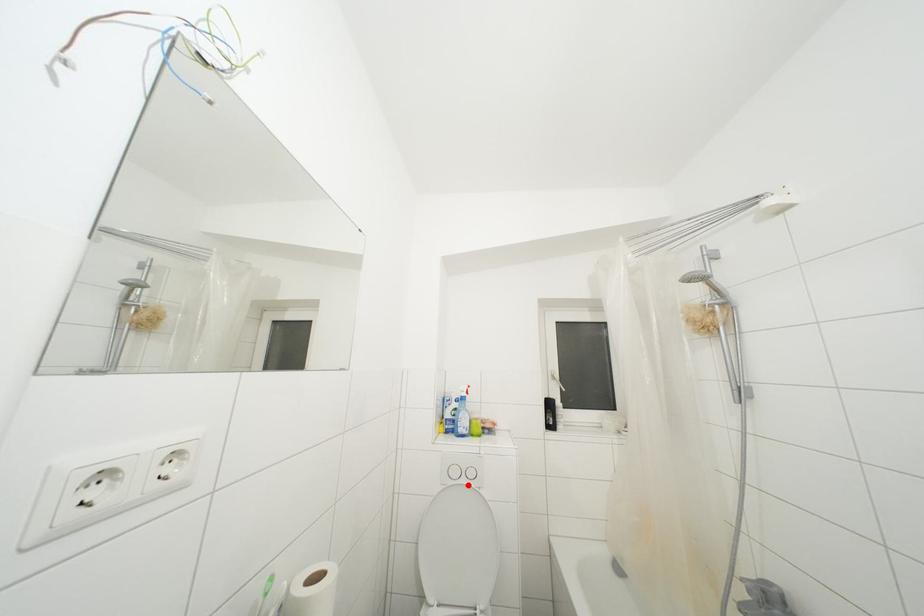
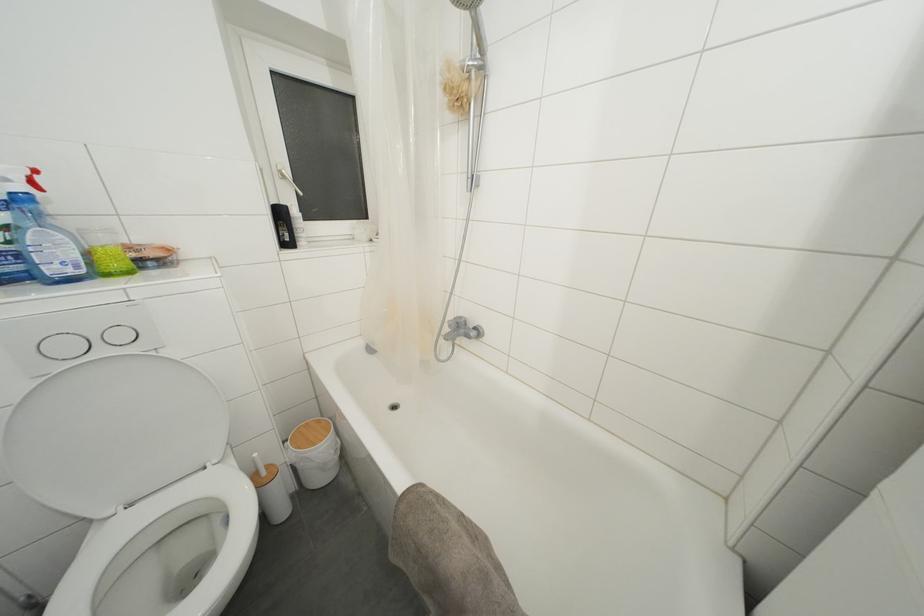
Question: I am providing you with two images of the same scene from different viewpoints. Given a red point in image1, look at the same physical point in image2. Is it:

Choices:
 (A) Closer to the viewpoint
 (B) Farther from the viewpoint

Answer: (A)